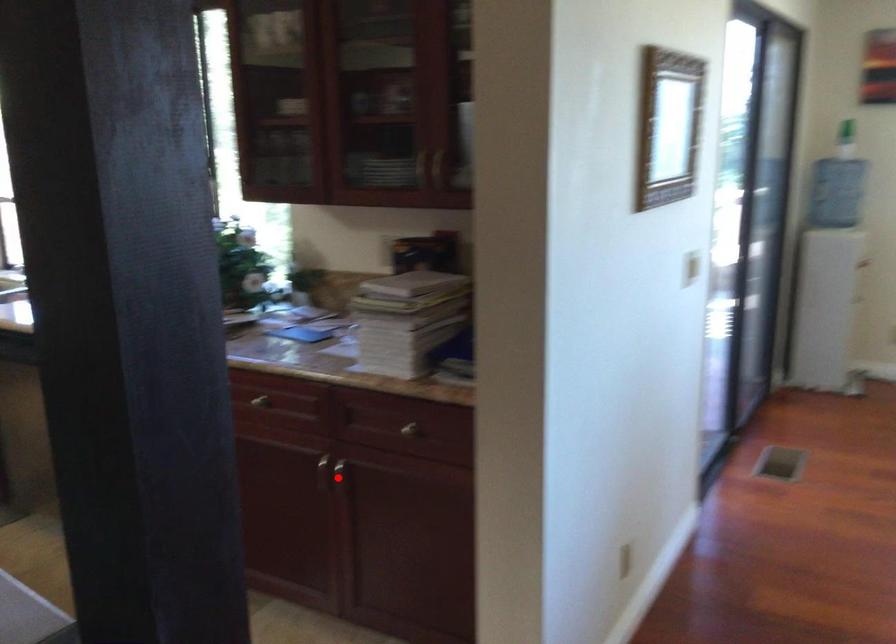
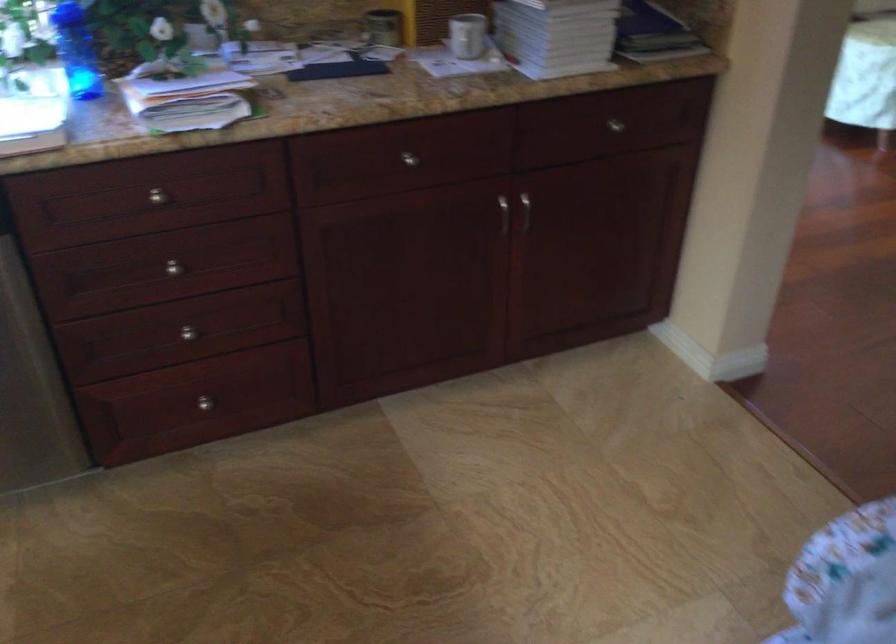
Question: I am providing you with two images of the same scene from different viewpoints. A red point is shown in image1. For the corresponding object point in image2, is it positioned nearer or farther from the camera?

Choices:
 (A) Nearer
 (B) Farther

Answer: (A)